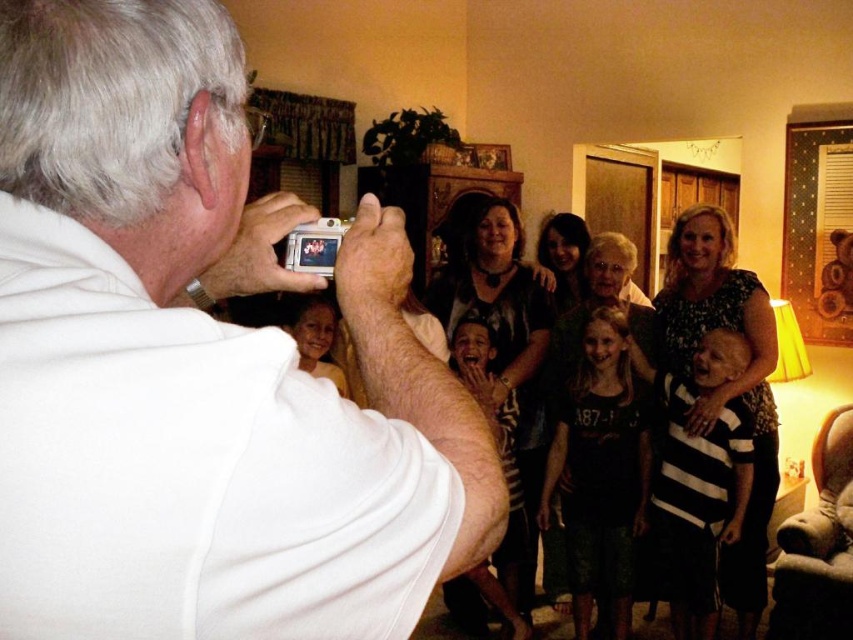
You are standing at point (222, 362) in the living room and want to take a photo of the group using a camera that has a minimum focusing distance of 50 centimeters. Can you take the photo without moving closer?

The point (222, 362) is 46.02 centimeters away from the camera, which is less than the minimum focusing distance of 50 centimeters. Therefore, you cannot take the photo without moving closer.

You are a photographer trying to capture a candid shot of the matte black dress at center without the subject noticing. The white matte camera at upper center is currently in your hand. Considering their heights, which object should you adjust to ensure the camera can discreetly focus on the dress?

The white matte camera at upper center has a lesser height compared to the matte black dress at center. To discreetly focus on the dress, lower the height of the white matte camera at upper center so it doesn

You are a photographer trying to frame a shot using the white matte camera at upper center. You notice the striped fabric baby at center is partially blocking your view. Can the camera fit into the space between the baby and the edge of the frame without moving the baby?

The white matte camera at upper center has a lesser width compared to striped fabric baby at center, so the camera can fit into the space between the baby and the edge of the frame without moving the baby.